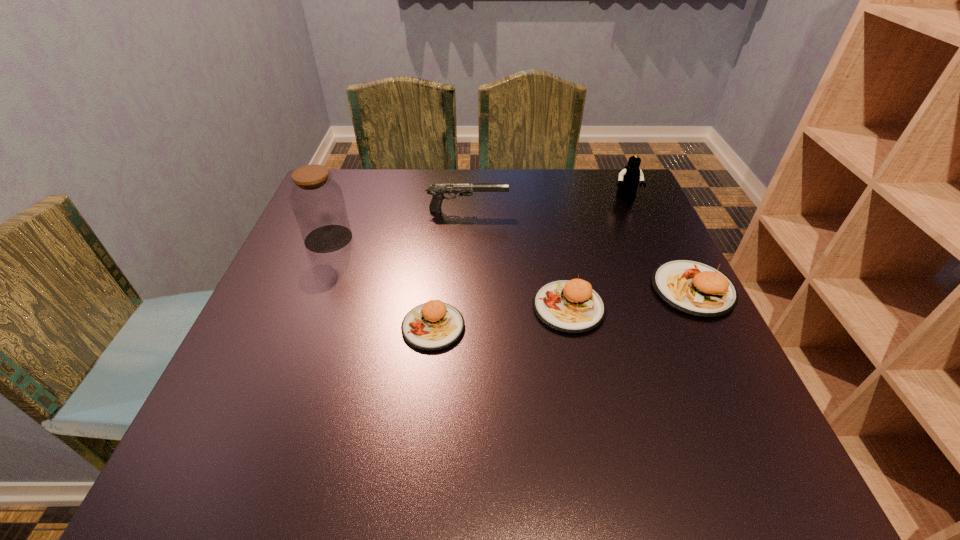
I want to click on free point located on the right of the shortest patty, so click(536, 327).

This screenshot has width=960, height=540. I want to click on free space located 0.050m on the front of the fourth object from left to right, so click(x=578, y=356).

Identify the location of blank area located 0.320m on the back of the rightmost patty. (642, 188).

Locate an element on the screen. free space located at the muzzle end of the second farthest object is located at coordinates (652, 211).

I want to click on vacant area situated on the front-facing side of the Lego, so click(668, 294).

The height and width of the screenshot is (540, 960). I want to click on vacant space located 0.380m on the right of the tallest object, so click(x=507, y=239).

Where is `gun that is at the far edge`? gun that is at the far edge is located at coordinates (437, 191).

The width and height of the screenshot is (960, 540). In order to click on Lego located in the far edge section of the desktop in this screenshot , I will do `click(629, 178)`.

This screenshot has height=540, width=960. What are the coordinates of `object at the left edge` in the screenshot? It's located at (317, 200).

The width and height of the screenshot is (960, 540). Find the location of `patty located in the right edge section of the desktop`. patty located in the right edge section of the desktop is located at coordinates (692, 287).